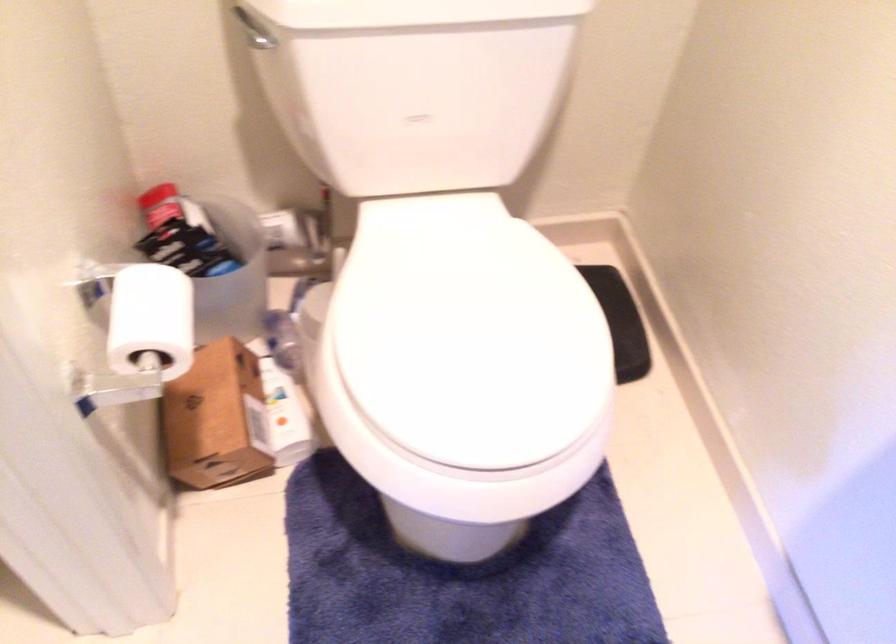
What do you see at coordinates (247, 20) in the screenshot? I see `a silver toilet handle` at bounding box center [247, 20].